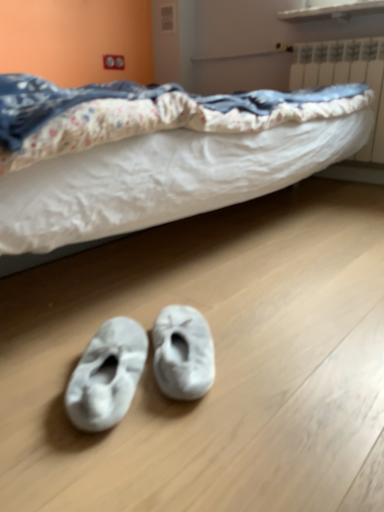
Locate an element on the screen. The image size is (384, 512). white fuzzy slippers at lower center, the 1th footwear viewed from the right is located at coordinates (183, 353).

Where is `white fuzzy slippers at lower center, the 1th footwear positioned from the left`? The height and width of the screenshot is (512, 384). white fuzzy slippers at lower center, the 1th footwear positioned from the left is located at coordinates 107,375.

The width and height of the screenshot is (384, 512). In order to click on white fuzzy slippers at lower center, the second footwear viewed from the left in this screenshot , I will do `click(183, 353)`.

Is the surface of white fuzzy slippers at lower center, which is the second footwear from right to left, in direct contact with white fuzzy slippers at lower center, the 1th footwear viewed from the right?

Absolutely, white fuzzy slippers at lower center, which is the second footwear from right to left, is next to and touching white fuzzy slippers at lower center, the 1th footwear viewed from the right.

From the picture: Considering the sizes of white fuzzy slippers at lower center, the 1th footwear positioned from the left, and white fuzzy slippers at lower center, the second footwear viewed from the left, in the image, is white fuzzy slippers at lower center, the 1th footwear positioned from the left, wider or thinner than white fuzzy slippers at lower center, the second footwear viewed from the left,?

Clearly, white fuzzy slippers at lower center, the 1th footwear positioned from the left, has less width compared to white fuzzy slippers at lower center, the second footwear viewed from the left.

At what (x,y) coordinates should I click in order to perform the action: click on footwear located above the white fuzzy slippers at lower center, the 1th footwear positioned from the left (from a real-world perspective). Please return your answer as a coordinate pair (x, y). Looking at the image, I should click on click(x=183, y=353).

Can you tell me how much white fuzzy slippers at lower center, the second footwear viewed from the left, and white fuzzy slippers at lower center, which is the second footwear from right to left, differ in facing direction?

They differ by 0 degrees in their facing directions.

Is white fuzzy slippers at lower center, the 1th footwear viewed from the right, aimed at white fuzzy slippers at lower center, which is the second footwear from right to left?

No, white fuzzy slippers at lower center, the 1th footwear viewed from the right, does not turn towards white fuzzy slippers at lower center, which is the second footwear from right to left.

Is white fuzzy slippers at lower center, the second footwear viewed from the left, not near white fuzzy slippers at lower center, the 1th footwear positioned from the left?

They are positioned close to each other.

Considering the sizes of objects white fuzzy slippers at lower center, which is the second footwear from right to left, and white plastic radiator at upper right in the image provided, who is thinner, white fuzzy slippers at lower center, which is the second footwear from right to left, or white plastic radiator at upper right?

white plastic radiator at upper right is thinner.

Can you see white fuzzy slippers at lower center, the 1th footwear positioned from the left, touching white plastic radiator at upper right?

No, white fuzzy slippers at lower center, the 1th footwear positioned from the left, is not beside white plastic radiator at upper right.

From a real-world perspective, is white fuzzy slippers at lower center, the 1th footwear positioned from the left, above or below white plastic radiator at upper right?

white fuzzy slippers at lower center, the 1th footwear positioned from the left, is below white plastic radiator at upper right.

At what (x,y) coordinates should I click in order to perform the action: click on radiator that is above the white fuzzy slippers at lower center, which is the second footwear from right to left (from the image's perspective). Please return your answer as a coordinate pair (x, y). This screenshot has width=384, height=512. Looking at the image, I should click on (346, 77).

Which object is positioned more to the left, white plastic radiator at upper right or white fuzzy slippers at lower center, the second footwear viewed from the left?

white fuzzy slippers at lower center, the second footwear viewed from the left, is more to the left.

Who is taller, white plastic radiator at upper right or white fuzzy slippers at lower center, the second footwear viewed from the left?

white plastic radiator at upper right is taller.

Does point (338, 61) come behind point (189, 395)?

Yes, it is behind point (189, 395).

Is white fuzzy slippers at lower center, the second footwear viewed from the left, positioned before white plastic radiator at upper right?

Yes, white fuzzy slippers at lower center, the second footwear viewed from the left, is in front of white plastic radiator at upper right.

How different are the orientations of white fuzzy slippers at lower center, the second footwear viewed from the left, and white plastic radiator at upper right in degrees?

They differ by 44.1 degrees in their facing directions.

Could you measure the distance between white fuzzy slippers at lower center, the 1th footwear viewed from the right, and white plastic radiator at upper right?

white fuzzy slippers at lower center, the 1th footwear viewed from the right, is 1.76 meters away from white plastic radiator at upper right.

Considering the sizes of objects white fuzzy slippers at lower center, the second footwear viewed from the left, and white plastic radiator at upper right in the image provided, who is thinner, white fuzzy slippers at lower center, the second footwear viewed from the left, or white plastic radiator at upper right?

white plastic radiator at upper right is thinner.

From a real-world perspective, is white plastic radiator at upper right on top of white fuzzy slippers at lower center, which is the second footwear from right to left?

Yes, from a real-world perspective, white plastic radiator at upper right is on top of white fuzzy slippers at lower center, which is the second footwear from right to left.

Between white plastic radiator at upper right and white fuzzy slippers at lower center, which is the second footwear from right to left, which one is positioned behind?

white plastic radiator at upper right is more distant.

Considering the positions of points (373, 153) and (106, 378), is point (373, 153) closer to camera compared to point (106, 378)?

That is False.

Is white plastic radiator at upper right with white fuzzy slippers at lower center, the 1th footwear positioned from the left?

There is a gap between white plastic radiator at upper right and white fuzzy slippers at lower center, the 1th footwear positioned from the left.

You are a GUI agent. You are given a task and a screenshot of the screen. Output one action in this format:
    pyautogui.click(x=<x>, y=<y>)
    Task: Click on the footwear below the white fuzzy slippers at lower center, the second footwear viewed from the left (from the image's perspective)
    This screenshot has height=512, width=384.
    Given the screenshot: What is the action you would take?
    pyautogui.click(x=107, y=375)

This screenshot has width=384, height=512. Find the location of `footwear directly beneath the white fuzzy slippers at lower center, the 1th footwear viewed from the right (from a real-world perspective)`. footwear directly beneath the white fuzzy slippers at lower center, the 1th footwear viewed from the right (from a real-world perspective) is located at coordinates (107, 375).

Which object lies nearer to the anchor point white fuzzy slippers at lower center, the 1th footwear viewed from the right, white plastic radiator at upper right or white fuzzy slippers at lower center, which is the second footwear from right to left?

Based on the image, white fuzzy slippers at lower center, which is the second footwear from right to left, appears to be nearer to white fuzzy slippers at lower center, the 1th footwear viewed from the right.

Considering their positions, is white plastic radiator at upper right positioned further to white fuzzy slippers at lower center, which is the second footwear from right to left, than white fuzzy slippers at lower center, the 1th footwear viewed from the right?

white plastic radiator at upper right.

Based on their spatial positions, is white fuzzy slippers at lower center, the second footwear viewed from the left, or white fuzzy slippers at lower center, which is the second footwear from right to left, further from white plastic radiator at upper right?

Among the two, white fuzzy slippers at lower center, which is the second footwear from right to left, is located further to white plastic radiator at upper right.

When comparing their distances from white fuzzy slippers at lower center, the second footwear viewed from the left, does white fuzzy slippers at lower center, which is the second footwear from right to left, or white plastic radiator at upper right seem closer?

white fuzzy slippers at lower center, which is the second footwear from right to left, lies closer to white fuzzy slippers at lower center, the second footwear viewed from the left, than the other object.

Considering their positions, is white fuzzy slippers at lower center, the 1th footwear viewed from the right, positioned further to white fuzzy slippers at lower center, the 1th footwear positioned from the left, than white plastic radiator at upper right?

Among the two, white plastic radiator at upper right is located further to white fuzzy slippers at lower center, the 1th footwear positioned from the left.

When comparing their distances from white plastic radiator at upper right, does white fuzzy slippers at lower center, the 1th footwear positioned from the left, or white fuzzy slippers at lower center, the 1th footwear viewed from the right, seem closer?

white fuzzy slippers at lower center, the 1th footwear viewed from the right, is positioned closer to the anchor white plastic radiator at upper right.

Where is `footwear between white fuzzy slippers at lower center, which is the second footwear from right to left, and white plastic radiator at upper right in the front-back direction`? footwear between white fuzzy slippers at lower center, which is the second footwear from right to left, and white plastic radiator at upper right in the front-back direction is located at coordinates (183, 353).